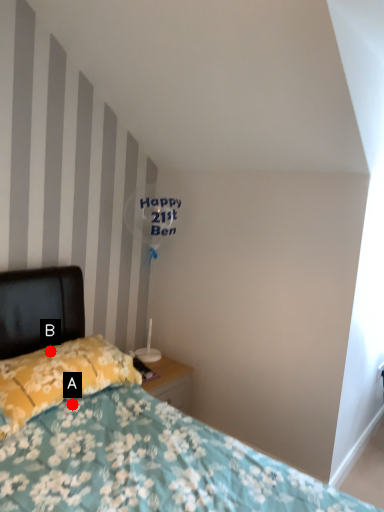
Question: Two points are circled on the image, labeled by A and B beside each circle. Which point appears farthest from the camera in this image?

Choices:
 (A) A is further
 (B) B is further

Answer: (B)